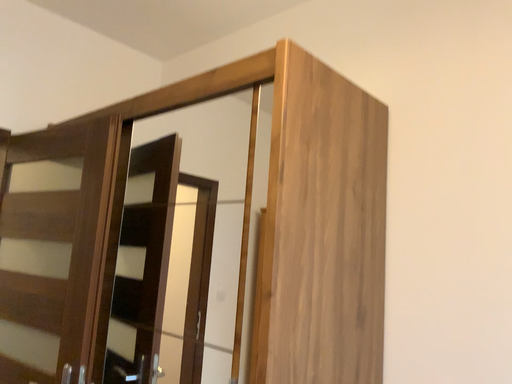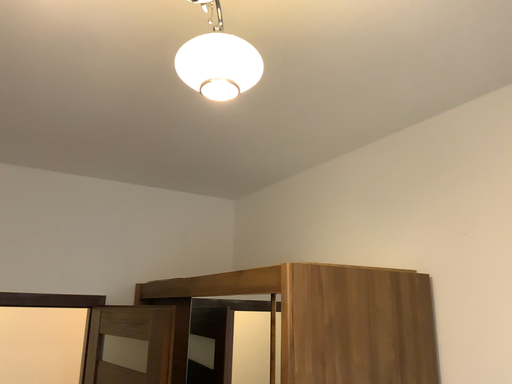
Question: Which way did the camera rotate in the video?

Choices:
 (A) rotated right
 (B) rotated left

Answer: (B)